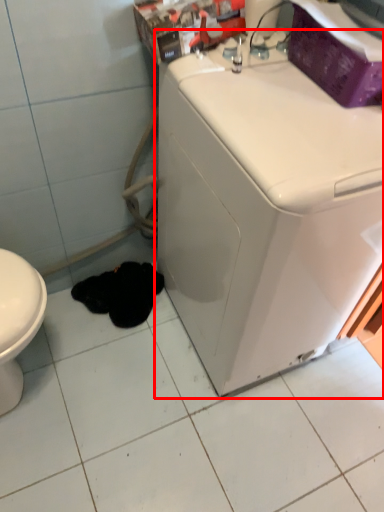
Question: From the image's perspective, where is washing machine (annotated by the red box) located relative to animal?

Choices:
 (A) above
 (B) below

Answer: (A)